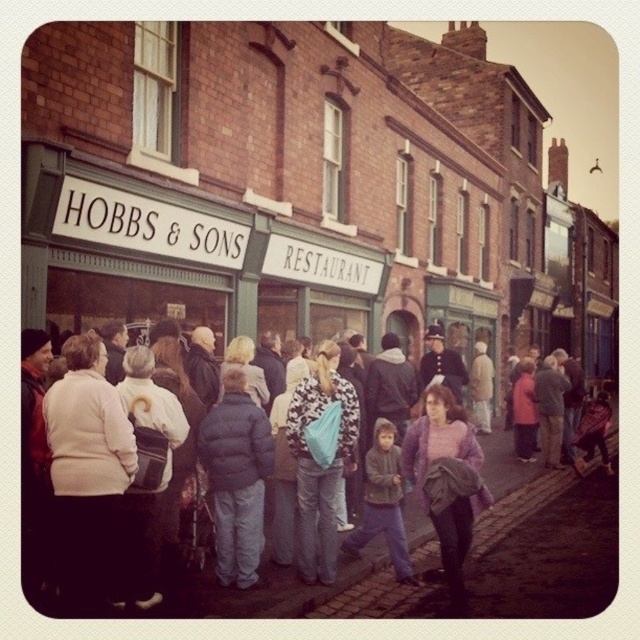
Based on the photo, is purple fuzzy sweater at center in front of denim jacket at center?

Yes, purple fuzzy sweater at center is closer to the viewer.

Describe the element at coordinates (429, 486) in the screenshot. I see `purple fuzzy sweater at center` at that location.

Which is in front, point (454, 540) or point (396, 522)?

Point (454, 540) is more forward.

Locate an element on the screen. Image resolution: width=640 pixels, height=640 pixels. purple fuzzy sweater at center is located at coordinates (429, 486).

Does matte blue jacket at center have a greater height compared to purple fuzzy sweater at center?

Yes, matte blue jacket at center is taller than purple fuzzy sweater at center.

Is point (387, 556) positioned before point (449, 588)?

No, it is behind (449, 588).

Locate an element on the screen. This screenshot has height=640, width=640. matte blue jacket at center is located at coordinates (512, 497).

Where is `dark blue puffer jacket at center`? Image resolution: width=640 pixels, height=640 pixels. dark blue puffer jacket at center is located at coordinates (236, 477).

Can you confirm if dark blue puffer jacket at center is shorter than purple fuzzy sweater at center?

Correct, dark blue puffer jacket at center is not as tall as purple fuzzy sweater at center.

Identify the location of dark blue puffer jacket at center. (236, 477).

The height and width of the screenshot is (640, 640). I want to click on dark blue puffer jacket at center, so click(x=236, y=477).